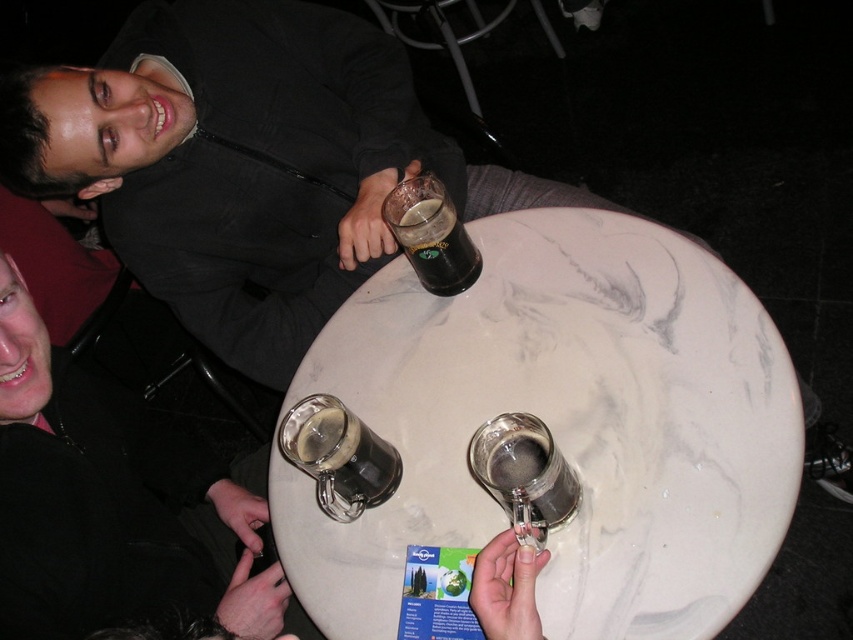
Question: Can you confirm if translucent glass mug at lower center is thinner than dark glass mug at center?

Choices:
 (A) yes
 (B) no

Answer: (A)

Question: Which point is closer to the camera?

Choices:
 (A) (473, 458)
 (B) (416, 186)
 (C) (640, 429)

Answer: (A)

Question: Based on their relative distances, which object is farther from the matte black jacket at upper left?

Choices:
 (A) white marble table at center
 (B) translucent glass mug at lower center
 (C) dark glass mug at center

Answer: (C)

Question: Considering the relative positions of translucent glass mug at lower center and dark glass mug at center in the image provided, where is translucent glass mug at lower center located with respect to dark glass mug at center?

Choices:
 (A) below
 (B) above

Answer: (A)

Question: Can you confirm if matte black jacket at upper left is smaller than dark glass mug at center?

Choices:
 (A) yes
 (B) no

Answer: (B)

Question: Which point is farther to the camera?

Choices:
 (A) white marble table at center
 (B) matte black jacket at upper left
 (C) translucent glass mug at lower center

Answer: (A)